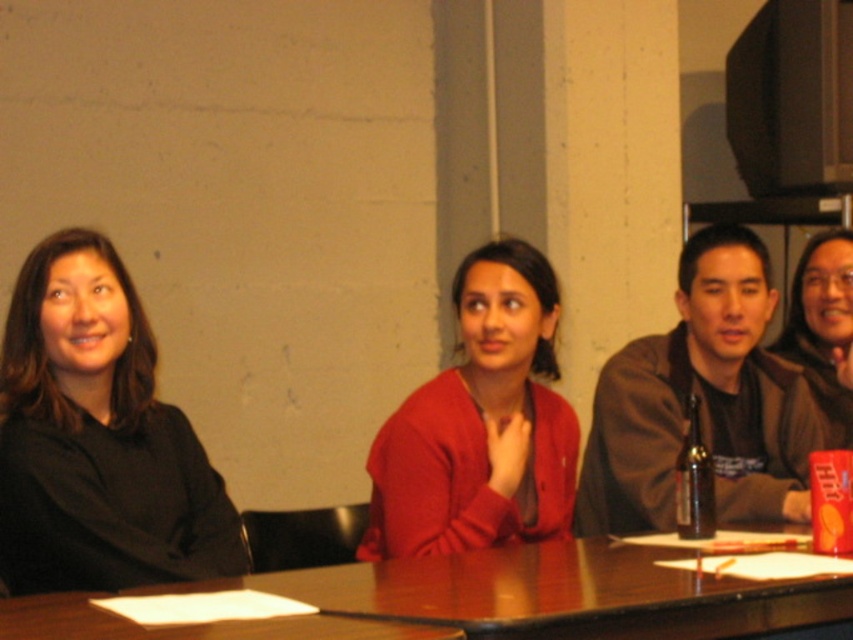
Question: Considering the relative positions of orange matte can at center right and brown glass bottle at center-right in the image provided, where is orange matte can at center right located with respect to brown glass bottle at center-right?

Choices:
 (A) left
 (B) right

Answer: (B)

Question: Which of the following is the closest to the observer?

Choices:
 (A) (84, 348)
 (B) (813, 540)
 (C) (726, 516)

Answer: (B)

Question: Which object is farther from the camera taking this photo?

Choices:
 (A) brown glass bottle at center-right
 (B) matte red sweater at center
 (C) orange matte can at center right
 (D) brown wooden table at center

Answer: (B)

Question: Does brown wooden table at center appear on the right side of matte red sweater at center?

Choices:
 (A) no
 (B) yes

Answer: (A)

Question: Which of these objects is positioned farthest from the brown leather jacket at right?

Choices:
 (A) matte black jacket at center
 (B) orange matte can at center right
 (C) brown glass bottle at center-right
 (D) matte red sweater at center

Answer: (B)

Question: Does black matte jacket at left have a greater width compared to matte red sweater at center?

Choices:
 (A) no
 (B) yes

Answer: (A)